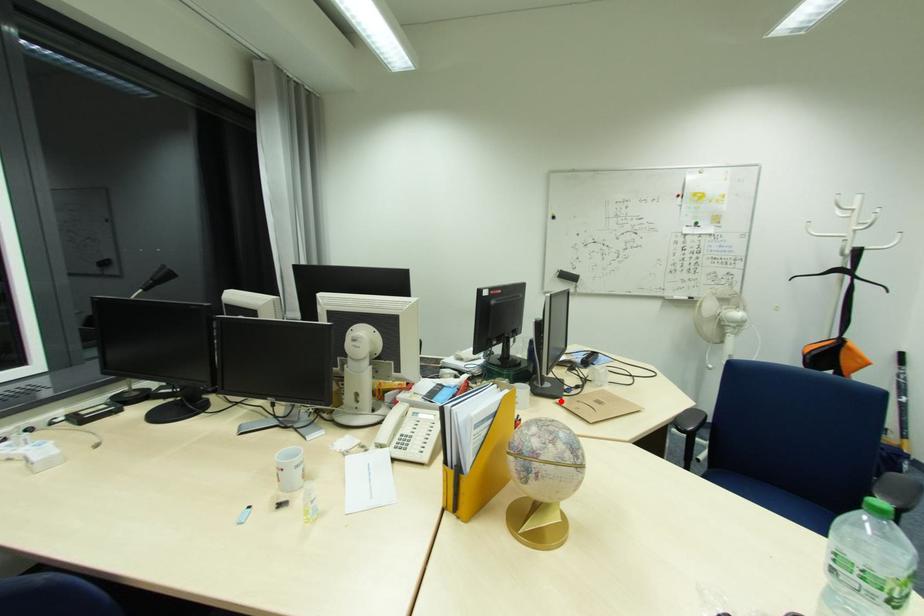
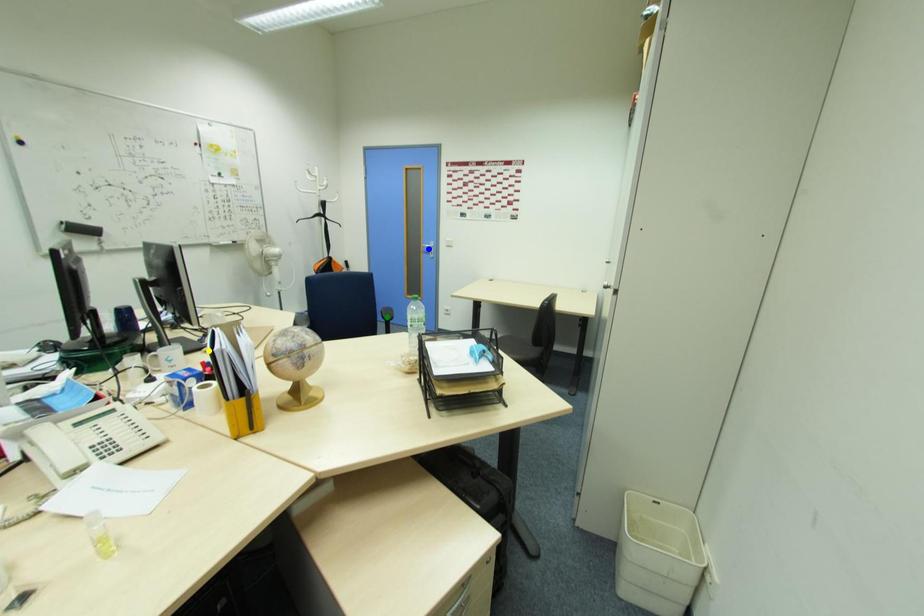
Question: I am providing you with two images of the same scene from different viewpoints. A red point is marked on the first image. You are given multiple points on the second image. Can you choose the point in image 2 that corresponds to the point in image 1?

Choices:
 (A) yellow point
 (B) blue point
 (C) green point

Answer: (A)